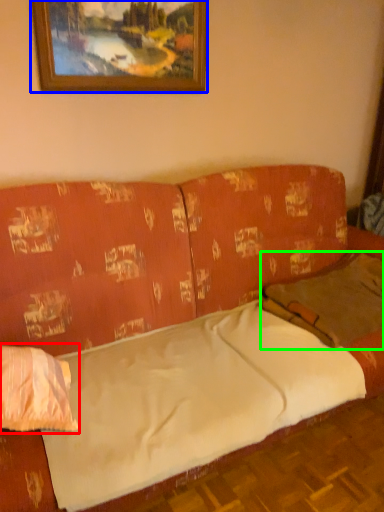
Question: Which is nearer to the pillow (highlighted by a red box)? picture frame (highlighted by a blue box) or pillow (highlighted by a green box).

Choices:
 (A) picture frame
 (B) pillow

Answer: (B)